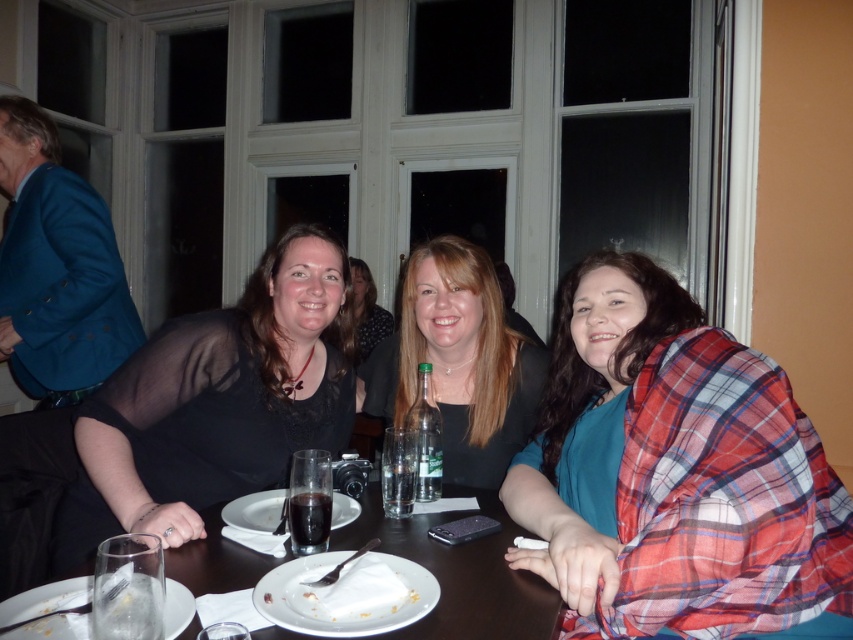
You are standing in a restaurant and want to take a photo of the group of women at the table. The camera you are using has a focal length of 50mm and a sensor size of 24mm x 36mm. If the point at coordinates point (189,394) is 1.55 meters away from the camera, will the entire group be visible in the photo?

The point at coordinates point (189,394) is 1.55 meters away from the camera. To determine if the entire group is visible, we need to calculate the field of view. With a 50mm lens and 24mm sensor width, the horizontal FOV is 2 arctan 24 2 50 2 approximately 27 degrees. The distance to the subject is 1.55 meters. The maximum width captured would be 2 tan 27 2 2 1.55 2 approximately 1.4 meters. The table and group likely fit within this width, so yes, the entire group should be visible.

You are a photographer standing 10 feet away from the table. You want to capture a closeup shot of the plaid fabric scarf at center without moving any objects. Can you adjust your position to get a clear shot of the scarf while keeping all three women in the frame?

The plaid fabric scarf at center is 37.84 inches away from the photographer, so moving closer would allow a clear closeup while still framing all three women.

You are a photographer standing in front of the three women at the table. You want to take a closeup shot of the black lace dress at center without moving the camera. Is the dress within your camera lens range if the camera can focus as close as 1 meter?

The black lace dress at center is 1.20 meters from the viewer. Since the camera can focus as close as 1 meter, the dress is within the camera lens range and can be captured in a closeup shot.